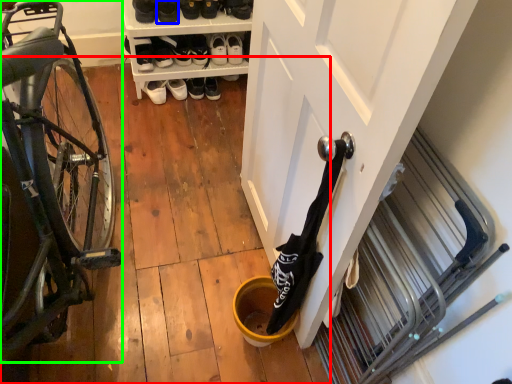
Question: Which object is the farthest from wood (highlighted by a red box)? Choose among these: footwear (highlighted by a blue box) or bicycle (highlighted by a green box).

Choices:
 (A) footwear
 (B) bicycle

Answer: (A)